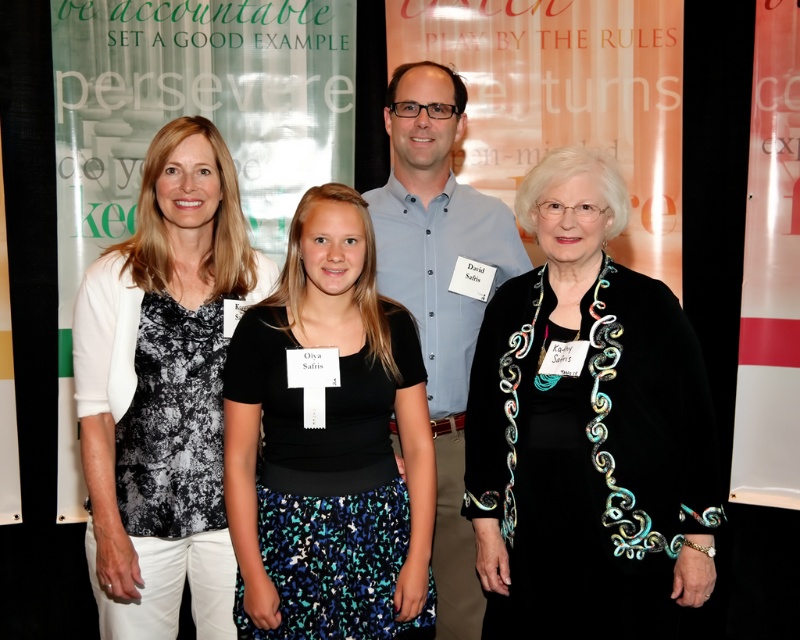
Question: Which of the following is the farthest from the observer?

Choices:
 (A) black textured dress at center
 (B) black printed blouse at left
 (C) black beaded necklace at right

Answer: (B)

Question: Can you confirm if black jersey at center is positioned above black printed blouse at left?

Choices:
 (A) no
 (B) yes

Answer: (A)

Question: Can you confirm if black jersey at center is positioned below light blue button-down shirt at center?

Choices:
 (A) no
 (B) yes

Answer: (B)

Question: Among these points, which one is farthest from the camera?

Choices:
 (A) (436, 577)
 (B) (440, 67)
 (C) (678, 304)
 (D) (360, 388)

Answer: (B)

Question: Does black printed blouse at left lie in front of light blue button-down shirt at center?

Choices:
 (A) no
 (B) yes

Answer: (B)

Question: Which object is closer to the camera taking this photo?

Choices:
 (A) light blue button-down shirt at center
 (B) black textured dress at center
 (C) black beaded necklace at right
 (D) black jersey at center

Answer: (C)